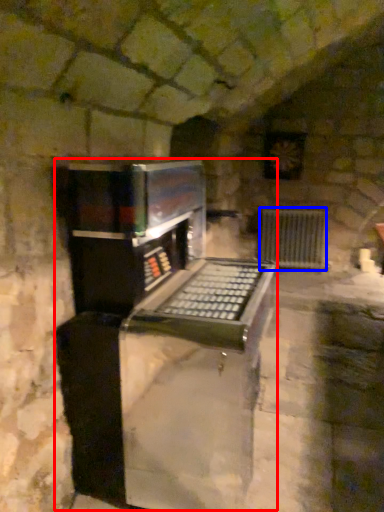
Question: Which object appears farthest to the camera in this image, appliance (highlighted by a red box) or radiator (highlighted by a blue box)?

Choices:
 (A) appliance
 (B) radiator

Answer: (B)